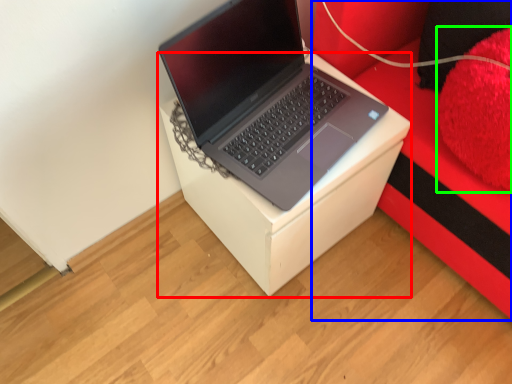
Question: Considering the real-world distances, which object is closest to table (highlighted by a red box)? furniture (highlighted by a blue box) or pillow (highlighted by a green box).

Choices:
 (A) furniture
 (B) pillow

Answer: (A)